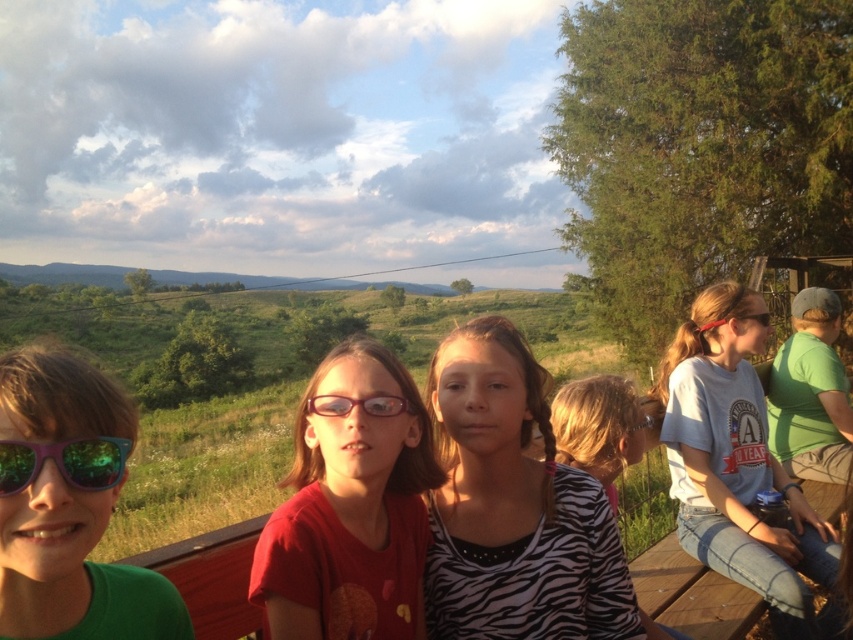
Question: Which of the following is the farthest from the observer?

Choices:
 (A) (x=178, y=600)
 (B) (x=299, y=552)
 (C) (x=602, y=625)
 (D) (x=740, y=333)

Answer: (D)

Question: In this image, where is matte green sunglasses at left located relative to pink plastic goggles at center?

Choices:
 (A) above
 (B) below

Answer: (B)

Question: Is matte green sunglasses at left positioned at the back of pink plastic goggles at center?

Choices:
 (A) yes
 (B) no

Answer: (B)

Question: Considering the real-world distances, which object is closest to the pink plastic goggles at center?

Choices:
 (A) zebra print shirt at center
 (B) white cotton shirt at right

Answer: (A)

Question: Is matte red shirt at center positioned behind pink plastic goggles at center?

Choices:
 (A) yes
 (B) no

Answer: (B)

Question: Which point appears closest to the camera in this image?

Choices:
 (A) (369, 474)
 (B) (814, 524)

Answer: (A)